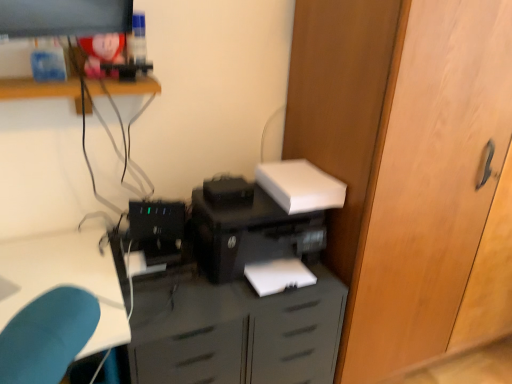
The width and height of the screenshot is (512, 384). What are the coordinates of `wooden shelf at upper left` in the screenshot? It's located at (40, 89).

What do you see at coordinates (262, 217) in the screenshot? I see `black plastic printer at center` at bounding box center [262, 217].

I want to click on matte black printer at lower center, so 234,332.

Identify the location of black plastic computer tower at center. pyautogui.click(x=157, y=230).

You are a GUI agent. You are given a task and a screenshot of the screen. Output one action in this format:
    pyautogui.click(x=<x>, y=<y>)
    Task: Click on the wooden shelf at upper left
    
    Given the screenshot: What is the action you would take?
    pyautogui.click(x=40, y=89)

Can you confirm if black plastic computer tower at center is thinner than wooden door at center-right?

Yes, black plastic computer tower at center is thinner than wooden door at center-right.

Considering their positions, is black plastic computer tower at center located in front of or behind wooden door at center-right?

black plastic computer tower at center is positioned farther from the viewer than wooden door at center-right.

Considering the positions of objects black plastic computer tower at center and wooden door at center-right in the image provided, who is more to the left, black plastic computer tower at center or wooden door at center-right?

From the viewer's perspective, black plastic computer tower at center appears more on the left side.

Is black plastic computer tower at center looking in the opposite direction of wooden door at center-right?

No, black plastic computer tower at center's orientation is not away from wooden door at center-right.

Is matte black printer at lower center outside of black plastic printer at center?

Yes, matte black printer at lower center is not within black plastic printer at center.

Looking at the image, does matte black printer at lower center seem bigger or smaller compared to black plastic printer at center?

In the image, matte black printer at lower center appears to be larger than black plastic printer at center.

Does matte black printer at lower center turn towards black plastic printer at center?

No, matte black printer at lower center is not oriented towards black plastic printer at center.

Is black plastic printer at center positioned before matte black printer at lower center?

Yes, black plastic printer at center is closer to the viewer.

From a real-world perspective, is black plastic printer at center on matte black printer at lower center?

Yes, from a real-world perspective, black plastic printer at center is over matte black printer at lower center

Does black plastic printer at center have a smaller size compared to matte black printer at lower center?

Yes.

Considering the positions of point (206, 263) and point (460, 130), is point (206, 263) closer or farther from the camera than point (460, 130)?

Clearly, point (206, 263) is closer to the camera than point (460, 130).

From the image's perspective, which is below, black plastic printer at center or wooden door at center-right?

black plastic printer at center, from the image's perspective.

Is black plastic printer at center spatially inside wooden door at center-right, or outside of it?

The correct answer is: outside.

Which is behind, point (51, 83) or point (149, 364)?

The point (51, 83) is more distant.

Considering the sizes of objects wooden shelf at upper left and matte black printer at lower center in the image provided, who is bigger, wooden shelf at upper left or matte black printer at lower center?

matte black printer at lower center.

Is wooden shelf at upper left in contact with matte black printer at lower center?

wooden shelf at upper left is not next to matte black printer at lower center, and they're not touching.

From a real-world perspective, which object stands above the other?

In real-world perspective, wooden shelf at upper left is above.

Does point (261, 319) appear closer or farther from the camera than point (77, 83)?

Point (261, 319).

Would you consider matte black printer at lower center to be distant from wooden shelf at upper left?

No, matte black printer at lower center is not far from wooden shelf at upper left.

Can you confirm if matte black printer at lower center is wider than wooden shelf at upper left?

Correct, the width of matte black printer at lower center exceeds that of wooden shelf at upper left.

Is black plastic printer at center at the left side of black plastic computer tower at center?

Incorrect, black plastic printer at center is not on the left side of black plastic computer tower at center.

In the scene shown: Considering the relative sizes of black plastic printer at center and black plastic computer tower at center in the image provided, is black plastic printer at center wider than black plastic computer tower at center?

Yes.

From the image's perspective, which one is positioned lower, black plastic printer at center or black plastic computer tower at center?

black plastic printer at center appears lower in the image.

Find the location of a particular element. door that is above the black plastic computer tower at center (from the image's perspective) is located at coordinates (428, 183).

Image resolution: width=512 pixels, height=384 pixels. What are the coordinates of `printer in front of the matte black printer at lower center` in the screenshot? It's located at (262, 217).

Based on their spatial positions, is wooden shelf at upper left or black plastic printer at center closer to black plastic computer tower at center?

black plastic printer at center is positioned closer to the anchor black plastic computer tower at center.

Estimate the real-world distances between objects in this image. Which object is further from wooden door at center-right, wooden shelf at upper left or black plastic printer at center?

wooden shelf at upper left is further to wooden door at center-right.

Which object lies further to the anchor point black plastic printer at center, wooden shelf at upper left or matte black printer at lower center?

wooden shelf at upper left is further to black plastic printer at center.

Looking at the image, which one is located closer to black plastic computer tower at center, black plastic printer at center or wooden door at center-right?

black plastic printer at center is positioned closer to the anchor black plastic computer tower at center.

Looking at the image, which one is located further to black plastic printer at center, wooden shelf at upper left or wooden door at center-right?

wooden shelf at upper left.

Considering their positions, is matte black printer at lower center positioned further to black plastic computer tower at center than black plastic printer at center?

matte black printer at lower center is further to black plastic computer tower at center.

Looking at this image, based on their spatial positions, is wooden door at center-right or matte black printer at lower center further from wooden shelf at upper left?

Among the two, wooden door at center-right is located further to wooden shelf at upper left.

Estimate the real-world distances between objects in this image. Which object is further from matte black printer at lower center, wooden shelf at upper left or black plastic printer at center?

wooden shelf at upper left.

Find the location of `cabinetry located between wooden shelf at upper left and wooden door at center-right in the left-right direction`. cabinetry located between wooden shelf at upper left and wooden door at center-right in the left-right direction is located at coordinates (234, 332).

You are a GUI agent. You are given a task and a screenshot of the screen. Output one action in this format:
    pyautogui.click(x=<x>, y=<y>)
    Task: Click on the printer between wooden shelf at upper left and wooden door at center-right from left to right
    The height and width of the screenshot is (384, 512).
    Given the screenshot: What is the action you would take?
    pyautogui.click(x=262, y=217)

This screenshot has width=512, height=384. I want to click on printer between black plastic computer tower at center and matte black printer at lower center from top to bottom, so click(x=262, y=217).

Identify the location of computer tower situated between wooden shelf at upper left and black plastic printer at center from left to right. This screenshot has width=512, height=384. (157, 230).